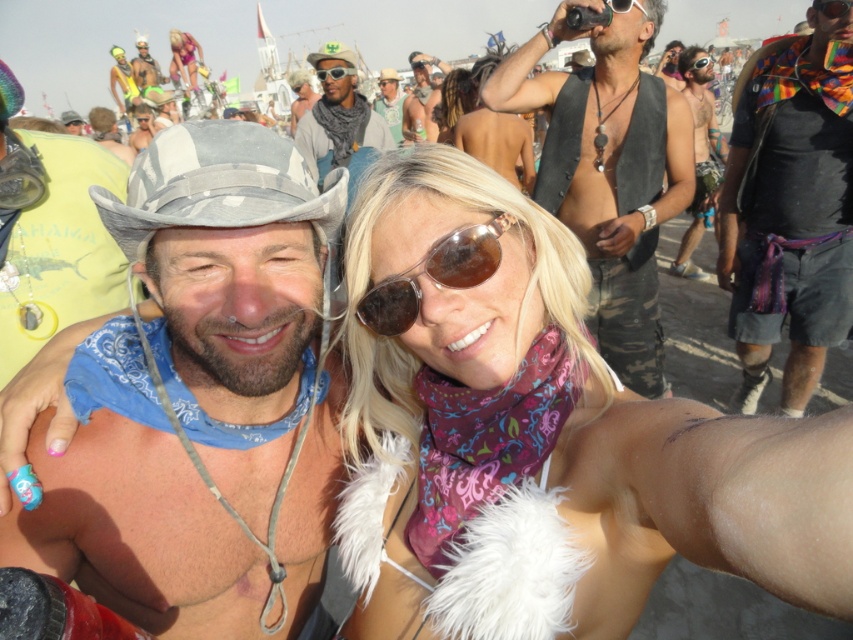
You are a photographer at the festival and want to capture a closeup shot of the matte pink bikini at upper left and the matte black cowboy hat at upper left. Since your camera can only focus on one object at a time, which object should you focus on first if you want to ensure the smaller object is in focus?

Answer: The matte pink bikini at upper left is smaller than the matte black cowboy hat at upper left, so you should focus on the matte pink bikini at upper left first to ensure it is in focus.

You are a photographer at the festival and want to capture a photo of the camouflage hat at upper center and the matte pink bikini at upper left. Which object should you focus on first to ensure it appears larger in the photo?

The camouflage hat at upper center should be focused on first because it is much taller than the matte pink bikini at upper left, so it will naturally appear larger in the photo.